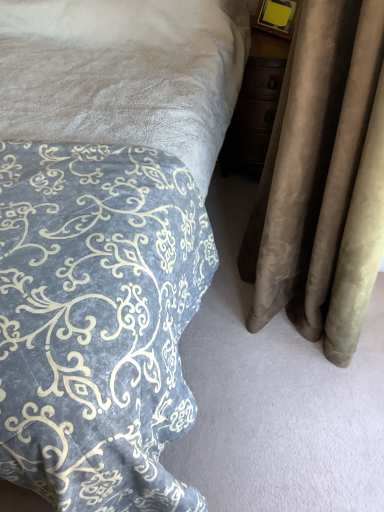
Describe the element at coordinates (323, 180) in the screenshot. This screenshot has height=512, width=384. I see `suede curtain at right` at that location.

This screenshot has width=384, height=512. I want to click on suede curtain at right, so click(x=323, y=180).

What do you see at coordinates (106, 237) in the screenshot? Image resolution: width=384 pixels, height=512 pixels. I see `velvet-patterned bedspread at lower left` at bounding box center [106, 237].

The height and width of the screenshot is (512, 384). In order to click on velvet-patterned bedspread at lower left in this screenshot , I will do point(106,237).

Measure the distance between point (0, 170) and camera.

Point (0, 170) is 1.20 meters from camera.

The image size is (384, 512). Identify the location of suede curtain at right. (323, 180).

Considering the positions of objects suede curtain at right and velvet-patterned bedspread at lower left in the image provided, who is more to the left, suede curtain at right or velvet-patterned bedspread at lower left?

velvet-patterned bedspread at lower left is more to the left.

Looking at this image, in the image, is suede curtain at right positioned in front of or behind velvet-patterned bedspread at lower left?

suede curtain at right is behind velvet-patterned bedspread at lower left.

Does point (333, 305) appear closer or farther from the camera than point (171, 321)?

Point (333, 305).

From the image's perspective, between suede curtain at right and velvet-patterned bedspread at lower left, which one is located above?

suede curtain at right is shown above in the image.

From a real-world perspective, does suede curtain at right sit lower than velvet-patterned bedspread at lower left?

Actually, suede curtain at right is physically above velvet-patterned bedspread at lower left in the real world.

Considering the relative sizes of suede curtain at right and velvet-patterned bedspread at lower left in the image provided, is suede curtain at right wider than velvet-patterned bedspread at lower left?

No, suede curtain at right is not wider than velvet-patterned bedspread at lower left.

Which of these two, suede curtain at right or velvet-patterned bedspread at lower left, stands taller?

With more height is velvet-patterned bedspread at lower left.

Does suede curtain at right have a larger size compared to velvet-patterned bedspread at lower left?

No.

Is velvet-patterned bedspread at lower left a part of suede curtain at right?

No, velvet-patterned bedspread at lower left is not inside suede curtain at right.

Would you say suede curtain at right is a long distance from velvet-patterned bedspread at lower left?

suede curtain at right is near velvet-patterned bedspread at lower left, not far away.

Could you tell me if suede curtain at right is facing velvet-patterned bedspread at lower left?

Yes, suede curtain at right faces towards velvet-patterned bedspread at lower left.

How many degrees apart are the facing directions of suede curtain at right and velvet-patterned bedspread at lower left?

There is a 90-degree angle between the facing directions of suede curtain at right and velvet-patterned bedspread at lower left.

In the scene shown: How much distance is there between suede curtain at right and velvet-patterned bedspread at lower left?

They are 53.56 centimeters apart.

Locate an element on the screen. curtain above the velvet-patterned bedspread at lower left (from the image's perspective) is located at coordinates (323, 180).

Considering the relative positions of velvet-patterned bedspread at lower left and suede curtain at right in the image provided, is velvet-patterned bedspread at lower left to the left of suede curtain at right from the viewer's perspective?

Yes, velvet-patterned bedspread at lower left is to the left of suede curtain at right.

Does velvet-patterned bedspread at lower left come behind suede curtain at right?

No, the depth of velvet-patterned bedspread at lower left is less than that of suede curtain at right.

Does point (114, 81) appear closer or farther from the camera than point (290, 194)?

Clearly, point (114, 81) is more distant from the camera than point (290, 194).

From the image's perspective, is velvet-patterned bedspread at lower left above suede curtain at right?

No, from the image's perspective, velvet-patterned bedspread at lower left is not above suede curtain at right.

From a real-world perspective, is velvet-patterned bedspread at lower left physically located above or below suede curtain at right?

Clearly, from a real-world perspective, velvet-patterned bedspread at lower left is below suede curtain at right.

Considering the sizes of objects velvet-patterned bedspread at lower left and suede curtain at right in the image provided, who is wider, velvet-patterned bedspread at lower left or suede curtain at right?

velvet-patterned bedspread at lower left is wider.

Is velvet-patterned bedspread at lower left shorter than suede curtain at right?

In fact, velvet-patterned bedspread at lower left may be taller than suede curtain at right.

Does velvet-patterned bedspread at lower left have a smaller size compared to suede curtain at right?

Incorrect, velvet-patterned bedspread at lower left is not smaller in size than suede curtain at right.

Is velvet-patterned bedspread at lower left inside or outside of suede curtain at right?

velvet-patterned bedspread at lower left is outside suede curtain at right.

Is velvet-patterned bedspread at lower left next to suede curtain at right?

velvet-patterned bedspread at lower left is not next to suede curtain at right, and they're not touching.

Is velvet-patterned bedspread at lower left turned away from suede curtain at right?

No.

How distant is velvet-patterned bedspread at lower left from suede curtain at right?

velvet-patterned bedspread at lower left and suede curtain at right are 21.09 inches apart.

Find the location of `curtain that appears on the right of velvet-patterned bedspread at lower left`. curtain that appears on the right of velvet-patterned bedspread at lower left is located at coordinates click(323, 180).

Locate an element on the screen. The image size is (384, 512). bed that is under the suede curtain at right (from a real-world perspective) is located at coordinates click(106, 237).

The image size is (384, 512). Identify the location of curtain on the right of velvet-patterned bedspread at lower left. (323, 180).